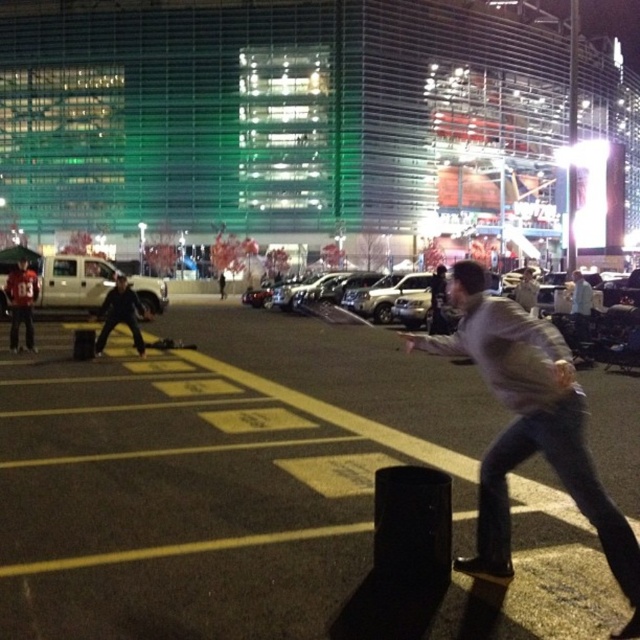
You are standing in the parking lot and want to walk towards the two points marked in the image. Which point, point (465, 394) or point (17, 348), will you reach first?

You will reach point (465, 394) first because it is closer to you than point (17, 348).